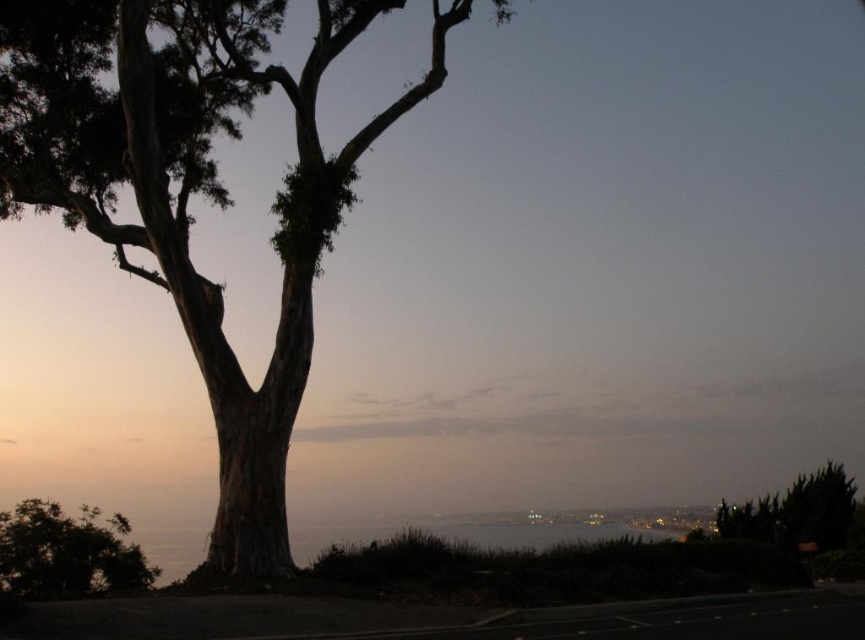
You are standing on the beach and see the smooth bark tree at left and the green leafy tree at lower left. Which tree is positioned higher in the image?

The smooth bark tree at left is positioned higher than the green leafy tree at lower left.

You are a photographer positioned at the center of the scene. You want to capture the smooth bark tree at left in your shot. Based on its 2D location coordinates, where should you aim your camera?

The smooth bark tree at left is located at coordinates point (193, 189), so you should aim your camera towards the lower left area of the scene.

You are a bird looking for a place to perch. You see the smooth bark tree at left and the green leafy tree at lower left. Which tree would you choose if you want to be higher up?

The smooth bark tree at left is taller than the green leafy tree at lower left, so you should choose the smooth bark tree at left to be higher up.